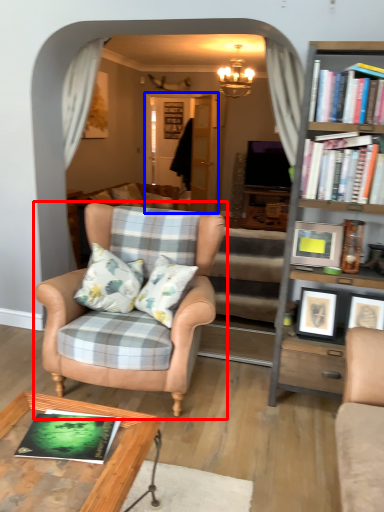
Question: Which point is further to the camera, chair (highlighted by a red box) or glass door (highlighted by a blue box)?

Choices:
 (A) chair
 (B) glass door

Answer: (B)